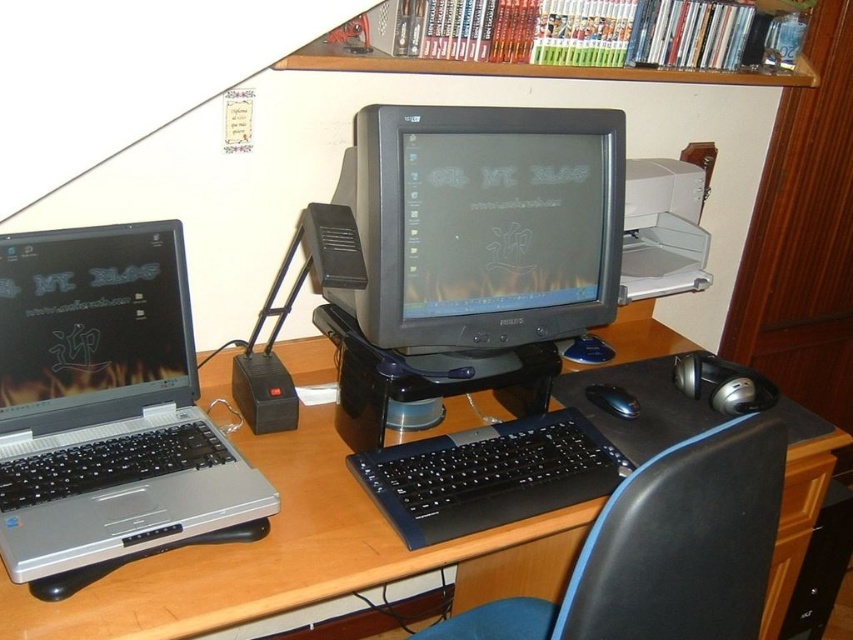
You are organizing your home office and want to place a new plant between the silver metallic laptop at left and the wooden desk at center. Can you fit the plant there?

The silver metallic laptop at left is to the left of the wooden desk at center, so there is space between them where the plant can be placed.

You are sitting in the black plastic chair at lower right and want to reach the silver metallic laptop at left. Which direction should you move to get closer to the laptop?

You should move to the left to get closer to the silver metallic laptop at left since it is positioned to the left of the black plastic chair at lower right.